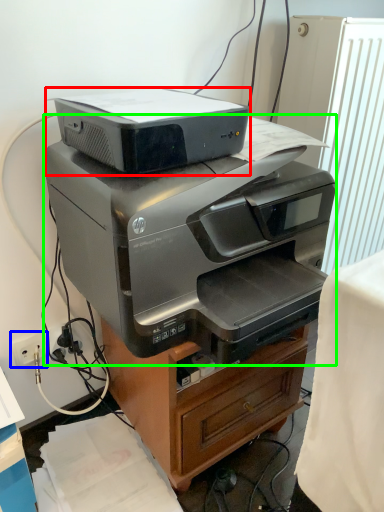
Question: Based on their relative distances, which object is farther from printer (highlighted by a red box)? Choose from electric outlet (highlighted by a blue box) and printer (highlighted by a green box).

Choices:
 (A) electric outlet
 (B) printer

Answer: (A)